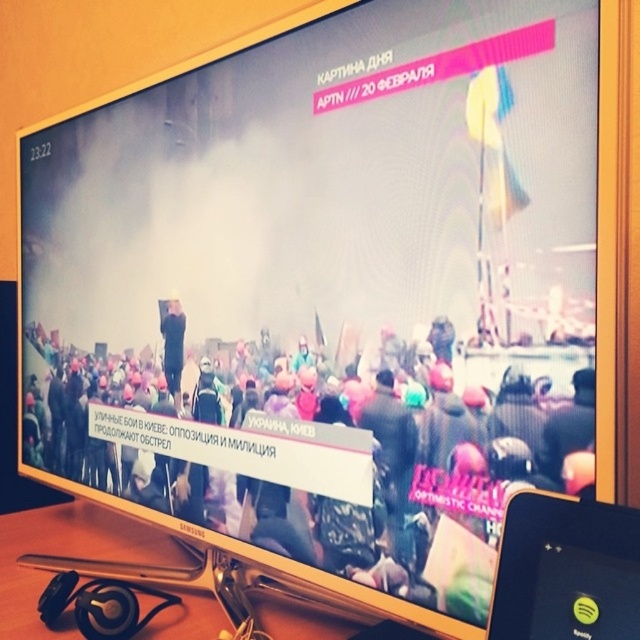
Who is lower down, multicolored fabric crowd at center or dark blue uniform at center?

Positioned lower is multicolored fabric crowd at center.

Does multicolored fabric crowd at center come in front of dark blue uniform at center?

Yes, multicolored fabric crowd at center is in front of dark blue uniform at center.

Is point (548, 451) closer to viewer compared to point (180, 368)?

Yes, point (548, 451) is closer to viewer.

The height and width of the screenshot is (640, 640). I want to click on multicolored fabric crowd at center, so click(x=310, y=451).

Between point (522, 509) and point (173, 401), which one is positioned behind?

The point (173, 401) is more distant.

Consider the image. Between matte black phone at lower right and dark blue uniform at center, which one is positioned lower?

Positioned lower is matte black phone at lower right.

Which is in front, point (570, 547) or point (173, 326)?

Point (570, 547) is in front.

Locate an element on the screen. The width and height of the screenshot is (640, 640). matte black phone at lower right is located at coordinates click(x=564, y=570).

Does point (369, 429) come in front of point (616, 624)?

No, (369, 429) is further to viewer.

Who is more distant from viewer, (x=268, y=346) or (x=525, y=579)?

The point (x=268, y=346) is behind.

Locate an element on the screen. The image size is (640, 640). multicolored fabric crowd at center is located at coordinates (310, 451).